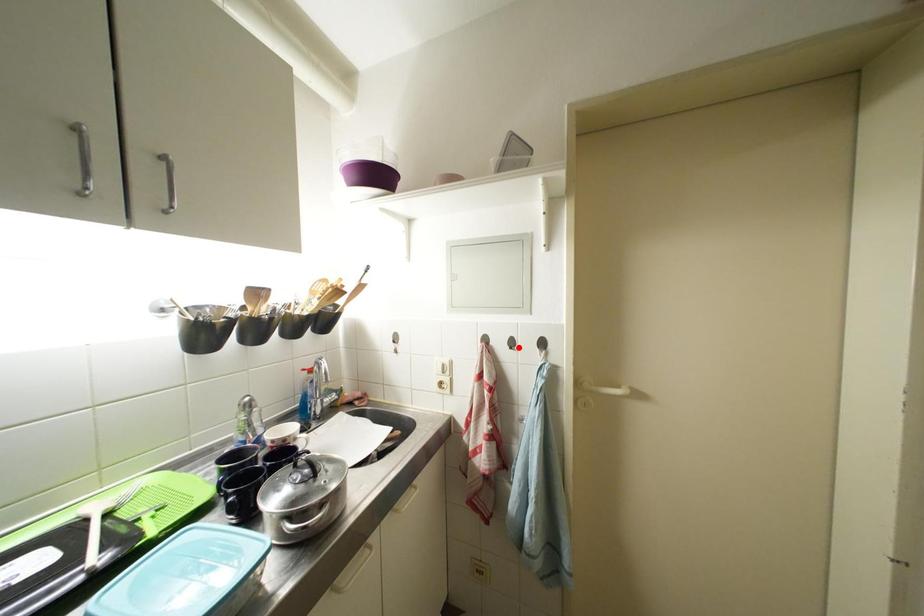
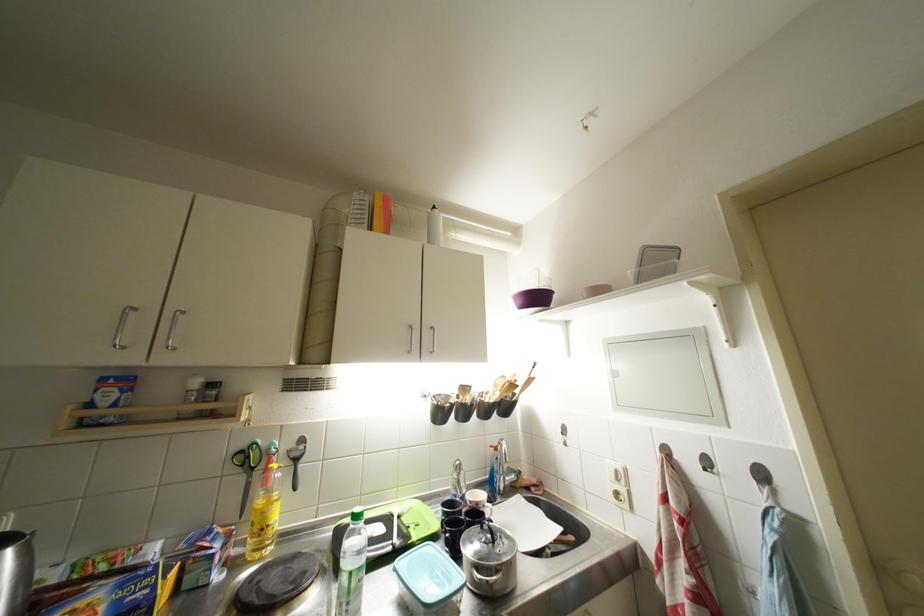
Locate, in the second image, the point that corresponds to the highlighted location in the first image.

(714, 467)